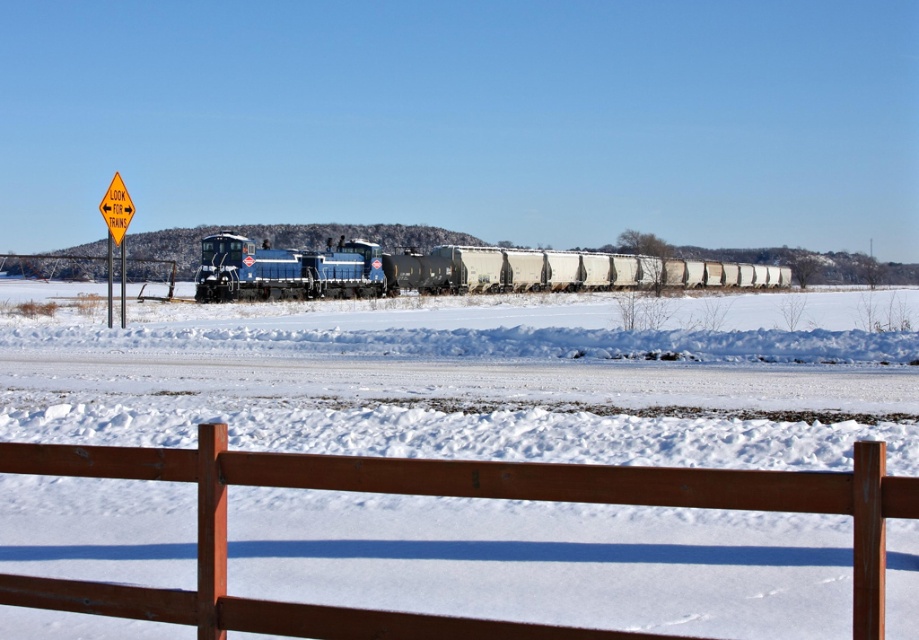
You are standing in a snowy landscape and see the brown wooden fence at lower center. If you want to reach the fence, how many steps of 3 feet each would you need to take?

The brown wooden fence at lower center is 10.28 feet away from the viewer. Since each step is 3 feet, you would need to take 4 steps to cover the distance, as 3 feet multiplied by 4 equals 12 feet, which exceeds the required 10.28 feet.

You are standing at the wooden fence in the foreground of the winter scene. You notice two points marked on the ground ahead of you. One is at point coordinates point (552, 636) and the other is at point coordinates point (599, 273). Which point is closer to your current position?

Point (552, 636) is closer to the camera than point (599, 273), so the point at coordinates point (552, 636) is closer to your current position at the wooden fence.

You are standing at the edge of the snowy field and see the brown wooden fence at lower center and the blue matte train at center. Which object is closer to your left side?

The brown wooden fence at lower center is to the left of the blue matte train at center, so it is closer to your left side.